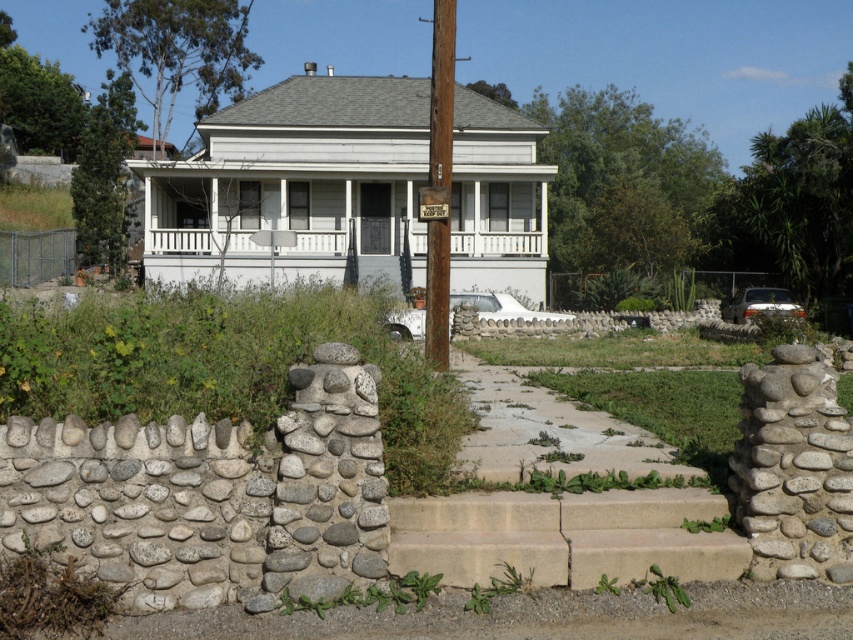
Question: Which is farther from the brown wooden telegraph pole at center?

Choices:
 (A) white painted wood porch at center
 (B) silver metallic sedan at right

Answer: (B)

Question: Considering the relative positions of brown wooden telegraph pole at center and silver metallic sedan at right in the image provided, where is brown wooden telegraph pole at center located with respect to silver metallic sedan at right?

Choices:
 (A) left
 (B) right

Answer: (A)

Question: Which point is farther to the camera?

Choices:
 (A) brown wooden telegraph pole at center
 (B) white matte truck at center
 (C) white painted wood porch at center

Answer: (C)

Question: Is brown wooden telegraph pole at center wider than white matte truck at center?

Choices:
 (A) yes
 (B) no

Answer: (B)

Question: Where is white painted wood porch at center located in relation to silver metallic sedan at right in the image?

Choices:
 (A) right
 (B) left

Answer: (B)

Question: Which point is closer to the camera taking this photo?

Choices:
 (A) (506, 298)
 (B) (769, 292)

Answer: (A)